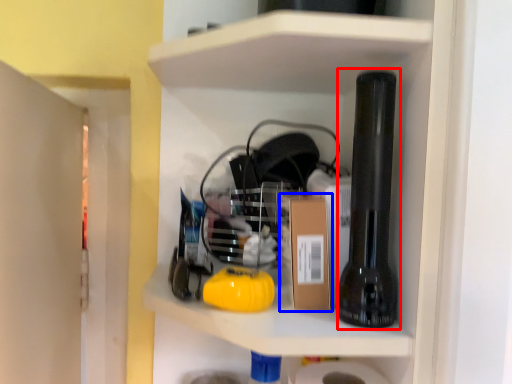
Question: Which point is further to the camera, beer bottle (highlighted by a red box) or cardboard box (highlighted by a blue box)?

Choices:
 (A) beer bottle
 (B) cardboard box

Answer: (B)